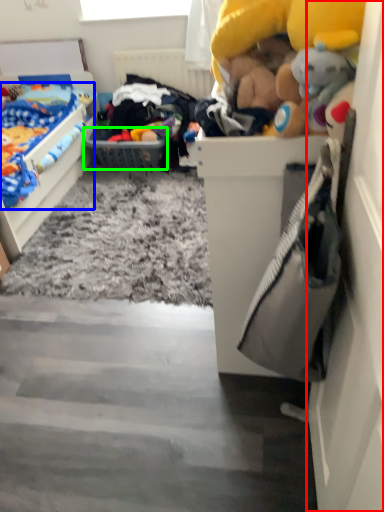
Question: Which is farther away from door (highlighted by a red box)? toy (highlighted by a blue box) or picnic basket (highlighted by a green box)?

Choices:
 (A) toy
 (B) picnic basket

Answer: (B)